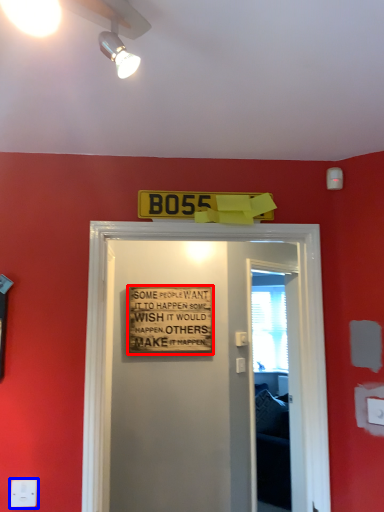
Question: Which of the following is the closest to the observer, warning sign (highlighted by a red box) or electric outlet (highlighted by a blue box)?

Choices:
 (A) warning sign
 (B) electric outlet

Answer: (B)